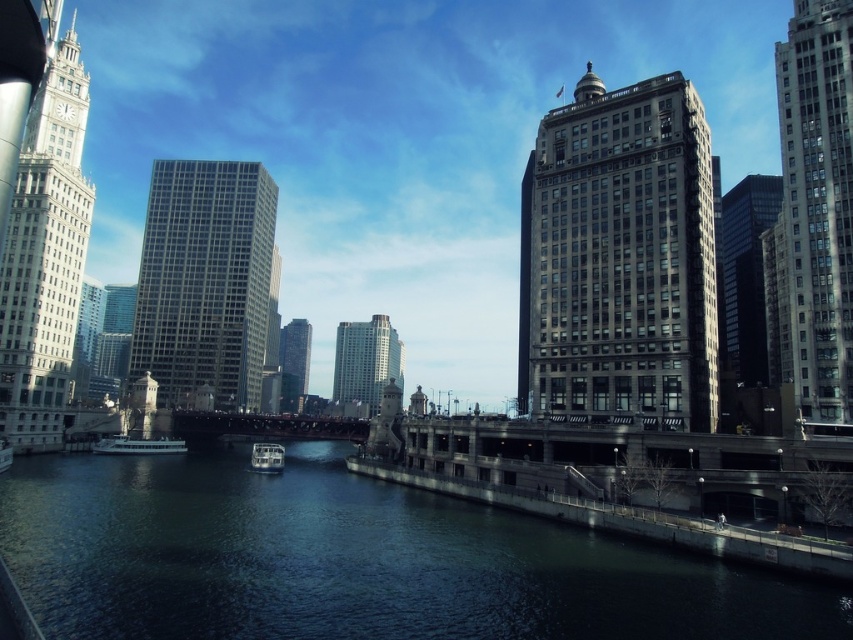
Can you confirm if white matte boat at lower left is shorter than white glossy boat at center?

Yes.

Who is taller, white matte boat at lower left or white glossy boat at center?

white glossy boat at center is taller.

Describe the element at coordinates (138, 445) in the screenshot. I see `white matte boat at lower left` at that location.

The image size is (853, 640). In order to click on white matte boat at lower left in this screenshot , I will do `click(138, 445)`.

Does dark water at center have a lesser width compared to white glossy boat at center?

In fact, dark water at center might be wider than white glossy boat at center.

Which is more to the right, dark water at center or white glossy boat at center?

From the viewer's perspective, dark water at center appears more on the right side.

Is point (492, 518) farther from viewer compared to point (265, 445)?

No.

You are a GUI agent. You are given a task and a screenshot of the screen. Output one action in this format:
    pyautogui.click(x=<x>, y=<y>)
    Task: Click on the dark water at center
    The height and width of the screenshot is (640, 853).
    Given the screenshot: What is the action you would take?
    pyautogui.click(x=352, y=561)

Can you confirm if dark gray stone building at center is bigger than white glass skyscraper at left?

No, dark gray stone building at center is not bigger than white glass skyscraper at left.

Which is above, dark gray stone building at center or white glass skyscraper at left?

dark gray stone building at center is higher up.

You are a GUI agent. You are given a task and a screenshot of the screen. Output one action in this format:
    pyautogui.click(x=<x>, y=<y>)
    Task: Click on the dark gray stone building at center
    
    Given the screenshot: What is the action you would take?
    pyautogui.click(x=619, y=259)